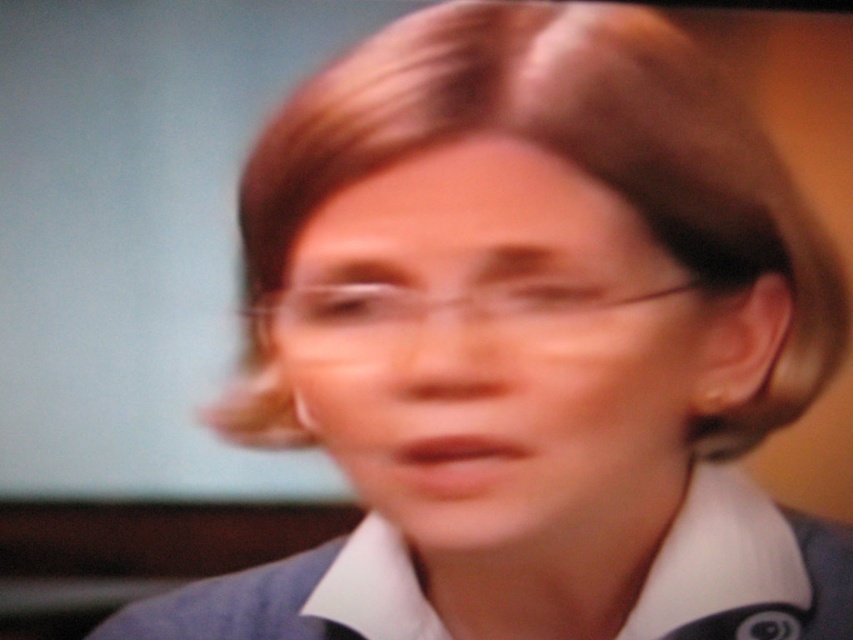
Between matte plastic face at center and clear plastic glasses at center, which one appears on the right side from the viewer's perspective?

matte plastic face at center is more to the right.

Describe the element at coordinates (492, 349) in the screenshot. This screenshot has width=853, height=640. I see `matte plastic face at center` at that location.

Where is `matte plastic face at center`? This screenshot has height=640, width=853. matte plastic face at center is located at coordinates (492, 349).

Between blue woolen blazer at center and clear plastic glasses at center, which one has less height?

Standing shorter between the two is clear plastic glasses at center.

Is blue woolen blazer at center bigger than clear plastic glasses at center?

Indeed, blue woolen blazer at center has a larger size compared to clear plastic glasses at center.

Is point (741, 588) positioned after point (306, 307)?

That is True.

I want to click on blue woolen blazer at center, so click(x=744, y=570).

Does matte plastic face at center have a lesser height compared to blue woolen blazer at center?

In fact, matte plastic face at center may be taller than blue woolen blazer at center.

Who is more distant from viewer, [677,292] or [807,518]?

The point [807,518] is more distant.

The width and height of the screenshot is (853, 640). I want to click on matte plastic face at center, so click(x=492, y=349).

Locate an element on the screen. matte plastic face at center is located at coordinates (492, 349).